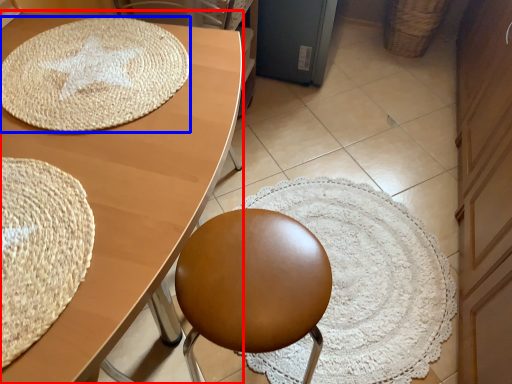
Question: Which object is closer to the camera taking this photo, table (highlighted by a red box) or mat (highlighted by a blue box)?

Choices:
 (A) table
 (B) mat

Answer: (A)